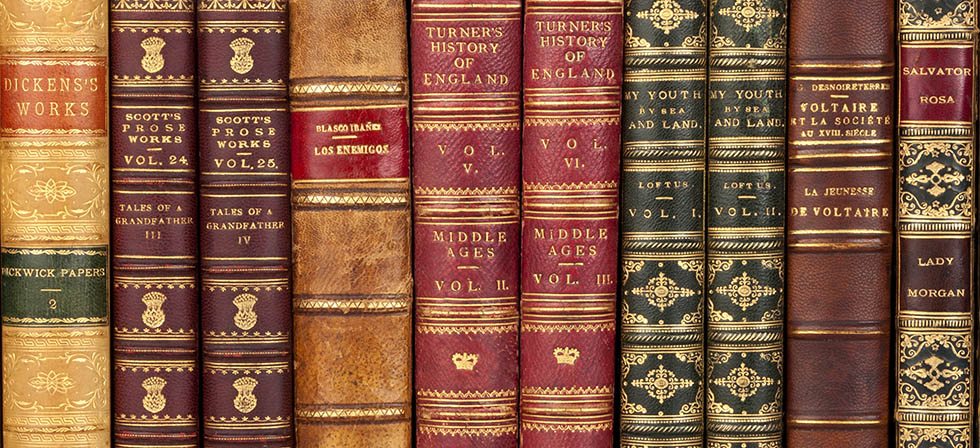
The height and width of the screenshot is (448, 980). What are the coordinates of `book` in the screenshot? It's located at (74, 177), (144, 187), (238, 200), (350, 206), (474, 228), (581, 237), (661, 229), (754, 232), (853, 229), (929, 230).